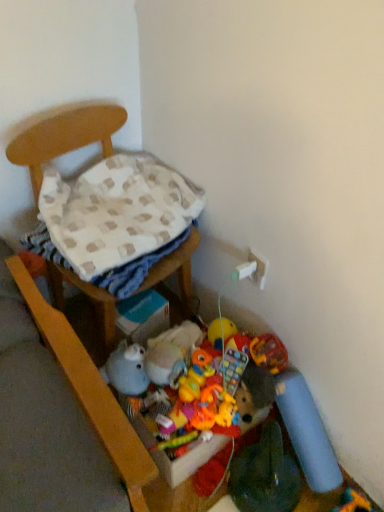
The width and height of the screenshot is (384, 512). What do you see at coordinates (65, 137) in the screenshot?
I see `wooden chair at left` at bounding box center [65, 137].

What do you see at coordinates (221, 331) in the screenshot? I see `soft plush duck at lower center, acting as the 2th toy starting from the left` at bounding box center [221, 331].

This screenshot has width=384, height=512. What do you see at coordinates (118, 216) in the screenshot?
I see `beige checkered blanket at left` at bounding box center [118, 216].

The image size is (384, 512). Find the location of `soft plush toy at lower right, positioned as the 1th toy in right-to-left order`. soft plush toy at lower right, positioned as the 1th toy in right-to-left order is located at coordinates 353,502.

Is beige checkered blanket at left beside fuzzy fabric stuffed animal at lower center, positioned as the second toy in top-to-bottom order?

No, beige checkered blanket at left is not making contact with fuzzy fabric stuffed animal at lower center, positioned as the second toy in top-to-bottom order.

Is beige checkered blanket at left bigger or smaller than fuzzy fabric stuffed animal at lower center, the first toy viewed from the left?

beige checkered blanket at left is bigger than fuzzy fabric stuffed animal at lower center, the first toy viewed from the left.

From the image's perspective, is beige checkered blanket at left under fuzzy fabric stuffed animal at lower center, the 3th toy when ordered from bottom to top?

Actually, beige checkered blanket at left appears above fuzzy fabric stuffed animal at lower center, the 3th toy when ordered from bottom to top, in the image.

From the picture: Considering the relative positions of beige checkered blanket at left and fuzzy fabric stuffed animal at lower center, the first toy viewed from the left, in the image provided, is beige checkered blanket at left to the right of fuzzy fabric stuffed animal at lower center, the first toy viewed from the left, from the viewer's perspective?

No.

Considering the relative sizes of wooden chair at left and rubberized plastic toy at center, the third toy viewed from the top, in the image provided, is wooden chair at left smaller than rubberized plastic toy at center, the third toy viewed from the top,?

No, wooden chair at left is not smaller than rubberized plastic toy at center, the third toy viewed from the top.

Which object is closer to the camera, wooden chair at left or rubberized plastic toy at center, which ranks as the second toy in right-to-left order?

Positioned in front is wooden chair at left.

Considering the relative positions of wooden chair at left and rubberized plastic toy at center, marked as the second toy in a bottom-to-top arrangement, in the image provided, is wooden chair at left to the left of rubberized plastic toy at center, marked as the second toy in a bottom-to-top arrangement, from the viewer's perspective?

Yes.

From the picture: From a real-world perspective, is wooden chair at left above or below rubberized plastic toy at center, marked as the second toy in a bottom-to-top arrangement?

Clearly, from a real-world perspective, wooden chair at left is above rubberized plastic toy at center, marked as the second toy in a bottom-to-top arrangement.

From the image's perspective, which object appears higher, soft plush toy at lower right, the 4th toy positioned from the top, or fuzzy fabric stuffed animal at lower center, the first toy viewed from the left?

fuzzy fabric stuffed animal at lower center, the first toy viewed from the left, is shown above in the image.

From a real-world perspective, is soft plush toy at lower right, which ranks as the fourth toy in left-to-right order, physically located above or below fuzzy fabric stuffed animal at lower center, the first toy viewed from the left?

Answer: Clearly, from a real-world perspective, soft plush toy at lower right, which ranks as the fourth toy in left-to-right order, is below fuzzy fabric stuffed animal at lower center, the first toy viewed from the left.

What's the angular difference between soft plush toy at lower right, which is the 1th toy from bottom to top, and fuzzy fabric stuffed animal at lower center, the first toy viewed from the left,'s facing directions?

The angular difference between soft plush toy at lower right, which is the 1th toy from bottom to top, and fuzzy fabric stuffed animal at lower center, the first toy viewed from the left, is 85.7 degrees.

Considering the sizes of soft plush toy at lower right, which ranks as the fourth toy in left-to-right order, and fuzzy fabric stuffed animal at lower center, the first toy viewed from the left, in the image, is soft plush toy at lower right, which ranks as the fourth toy in left-to-right order, wider or thinner than fuzzy fabric stuffed animal at lower center, the first toy viewed from the left,?

In the image, soft plush toy at lower right, which ranks as the fourth toy in left-to-right order, appears to be wider than fuzzy fabric stuffed animal at lower center, the first toy viewed from the left.

Based on the photo, is wooden chair at left far from soft plush toy at lower right, the 4th toy positioned from the top?

No, wooden chair at left is not far away from soft plush toy at lower right, the 4th toy positioned from the top.

Is wooden chair at left positioned behind soft plush toy at lower right, which ranks as the fourth toy in left-to-right order?

No, it is in front of soft plush toy at lower right, which ranks as the fourth toy in left-to-right order.

From a real-world perspective, relative to soft plush toy at lower right, which is the 1th toy from bottom to top, is wooden chair at left vertically above or below?

Clearly, from a real-world perspective, wooden chair at left is above soft plush toy at lower right, which is the 1th toy from bottom to top.

Considering the sizes of objects wooden chair at left and soft plush toy at lower right, which ranks as the fourth toy in left-to-right order, in the image provided, who is taller, wooden chair at left or soft plush toy at lower right, which ranks as the fourth toy in left-to-right order,?

Standing taller between the two is wooden chair at left.

Which object is more forward, rubberized plastic toy at center, which appears as the 3th toy when viewed from the left, or soft plush toy at lower right, which is the 1th toy from bottom to top?

soft plush toy at lower right, which is the 1th toy from bottom to top.

Considering the sizes of objects rubberized plastic toy at center, which appears as the 3th toy when viewed from the left, and soft plush toy at lower right, positioned as the 1th toy in right-to-left order, in the image provided, who is taller, rubberized plastic toy at center, which appears as the 3th toy when viewed from the left, or soft plush toy at lower right, positioned as the 1th toy in right-to-left order,?

rubberized plastic toy at center, which appears as the 3th toy when viewed from the left, is taller.

From a real-world perspective, is rubberized plastic toy at center, marked as the second toy in a bottom-to-top arrangement, physically located above or below soft plush toy at lower right, the 4th toy positioned from the top?

From a real-world perspective, rubberized plastic toy at center, marked as the second toy in a bottom-to-top arrangement, is physically above soft plush toy at lower right, the 4th toy positioned from the top.

From the image's perspective, is rubberized plastic toy at center, marked as the second toy in a bottom-to-top arrangement, below soft plush toy at lower right, which is the 1th toy from bottom to top?

No.

Is the surface of soft plush duck at lower center, marked as the 4th toy in a bottom-to-top arrangement, in direct contact with fuzzy fabric stuffed animal at lower center, which is the fourth toy in right-to-left order?

soft plush duck at lower center, marked as the 4th toy in a bottom-to-top arrangement, and fuzzy fabric stuffed animal at lower center, which is the fourth toy in right-to-left order, are not in contact.

Is fuzzy fabric stuffed animal at lower center, the 3th toy when ordered from bottom to top, a part of soft plush duck at lower center, placed as the 3th toy when sorted from right to left?

No.

Consider the image. Which point is more forward, (219, 330) or (178, 346)?

The point (178, 346) is closer.

Is soft plush toy at lower right, positioned as the 1th toy in right-to-left order, facing towards soft plush duck at lower center, marked as the 4th toy in a bottom-to-top arrangement?

No.

Can you confirm if soft plush toy at lower right, the 4th toy positioned from the top, is thinner than soft plush duck at lower center, marked as the 4th toy in a bottom-to-top arrangement?

No.

How many degrees apart are the facing directions of soft plush toy at lower right, the 4th toy positioned from the top, and soft plush duck at lower center, placed as the 3th toy when sorted from right to left?

The angle between the facing direction of soft plush toy at lower right, the 4th toy positioned from the top, and the facing direction of soft plush duck at lower center, placed as the 3th toy when sorted from right to left, is 86.4 degrees.

Can you confirm if soft plush toy at lower right, which is the 1th toy from bottom to top, is shorter than soft plush duck at lower center, the 1th toy from the top?

Correct, soft plush toy at lower right, which is the 1th toy from bottom to top, is not as tall as soft plush duck at lower center, the 1th toy from the top.

The width and height of the screenshot is (384, 512). Find the location of `blanket to the left of fuzzy fabric stuffed animal at lower center, positioned as the second toy in top-to-bottom order`. blanket to the left of fuzzy fabric stuffed animal at lower center, positioned as the second toy in top-to-bottom order is located at coordinates (118, 216).

Locate an element on the screen. the 3rd toy to the right when counting from the wooden chair at left is located at coordinates (232, 369).

Looking at the image, which one is located further to soft plush duck at lower center, placed as the 3th toy when sorted from right to left, soft plush toy at lower right, which is the 1th toy from bottom to top, or rubberized plastic toy at center, which ranks as the second toy in right-to-left order?

soft plush toy at lower right, which is the 1th toy from bottom to top.

From the image, which object appears to be farther from wooden chair at left, beige checkered blanket at left or fuzzy fabric stuffed animal at lower center, the first toy viewed from the left?

fuzzy fabric stuffed animal at lower center, the first toy viewed from the left, is positioned further to the anchor wooden chair at left.

Considering their positions, is rubberized plastic toy at center, which ranks as the second toy in right-to-left order, positioned further to beige checkered blanket at left than soft plush duck at lower center, the 1th toy from the top?

rubberized plastic toy at center, which ranks as the second toy in right-to-left order.

Based on their spatial positions, is beige checkered blanket at left or wooden chair at left further from rubberized plastic toy at center, the third toy viewed from the top?

beige checkered blanket at left lies further to rubberized plastic toy at center, the third toy viewed from the top, than the other object.

From the image, which object appears to be farther from wooden chair at left, fuzzy fabric stuffed animal at lower center, the first toy viewed from the left, or rubberized plastic toy at center, marked as the second toy in a bottom-to-top arrangement?

rubberized plastic toy at center, marked as the second toy in a bottom-to-top arrangement, is further to wooden chair at left.

Which object lies further to the anchor point fuzzy fabric stuffed animal at lower center, which is the fourth toy in right-to-left order, soft plush toy at lower right, positioned as the 1th toy in right-to-left order, or beige checkered blanket at left?

Among the two, soft plush toy at lower right, positioned as the 1th toy in right-to-left order, is located further to fuzzy fabric stuffed animal at lower center, which is the fourth toy in right-to-left order.

When comparing their distances from rubberized plastic toy at center, marked as the second toy in a bottom-to-top arrangement, does beige checkered blanket at left or soft plush duck at lower center, marked as the 4th toy in a bottom-to-top arrangement, seem closer?

soft plush duck at lower center, marked as the 4th toy in a bottom-to-top arrangement, is positioned closer to the anchor rubberized plastic toy at center, marked as the second toy in a bottom-to-top arrangement.

Considering their positions, is soft plush toy at lower right, which is the 1th toy from bottom to top, positioned further to rubberized plastic toy at center, marked as the second toy in a bottom-to-top arrangement, than soft plush duck at lower center, placed as the 3th toy when sorted from right to left?

soft plush toy at lower right, which is the 1th toy from bottom to top.

Identify the location of furniture that lies between beige checkered blanket at left and fuzzy fabric stuffed animal at lower center, which is the fourth toy in right-to-left order, from top to bottom. (65, 137).

Where is `toy between beige checkered blanket at left and fuzzy fabric stuffed animal at lower center, the first toy viewed from the left, in the up-down direction`? This screenshot has height=512, width=384. toy between beige checkered blanket at left and fuzzy fabric stuffed animal at lower center, the first toy viewed from the left, in the up-down direction is located at coordinates (221, 331).

The height and width of the screenshot is (512, 384). What are the coordinates of `furniture between beige checkered blanket at left and rubberized plastic toy at center, marked as the second toy in a bottom-to-top arrangement, in the up-down direction` in the screenshot? It's located at (65, 137).

The image size is (384, 512). Identify the location of toy between fuzzy fabric stuffed animal at lower center, positioned as the second toy in top-to-bottom order, and rubberized plastic toy at center, the third toy viewed from the top, in the horizontal direction. (221, 331).